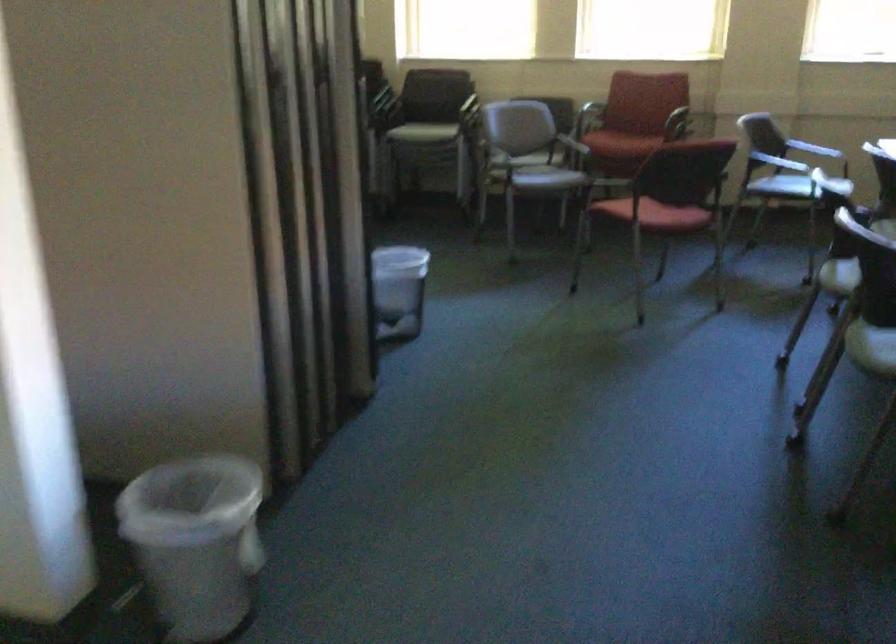
What are the coordinates of `grey chair sitting surface` in the screenshot? It's located at (545, 180).